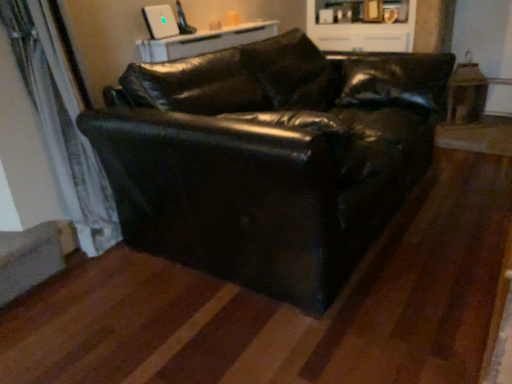
You are a GUI agent. You are given a task and a screenshot of the screen. Output one action in this format:
    pyautogui.click(x=<x>, y=<y>)
    Task: Click on the white glossy cabinet at upper center
    The width and height of the screenshot is (512, 384).
    Given the screenshot: What is the action you would take?
    pyautogui.click(x=362, y=25)

Describe the element at coordinates (62, 127) in the screenshot. The image size is (512, 384). I see `white sheer curtain at left` at that location.

The width and height of the screenshot is (512, 384). I want to click on white glossy table at upper center, so click(205, 41).

Locate an element on the screen. This screenshot has width=512, height=384. black leather couch at center is located at coordinates (269, 159).

Measure the distance between black leather couch at center and camera.

They are 3.93 feet apart.

Locate an element on the screen. white glossy cabinet at upper center is located at coordinates (362, 25).

Is white sheer curtain at left inside the boundaries of black leather couch at center, or outside?

white sheer curtain at left is spatially situated outside black leather couch at center.

Is the surface of white sheer curtain at left in direct contact with black leather couch at center?

white sheer curtain at left is not next to black leather couch at center, and they're not touching.

Where is `studio couch below the white sheer curtain at left (from a real-world perspective)`? The height and width of the screenshot is (384, 512). studio couch below the white sheer curtain at left (from a real-world perspective) is located at coordinates (269, 159).

From a real-world perspective, is white sheer curtain at left beneath white glossy cabinet at upper center?

Correct, in the physical world, white sheer curtain at left is lower than white glossy cabinet at upper center.

Based on the photo, would you say white sheer curtain at left contains white glossy cabinet at upper center?

No, white glossy cabinet at upper center is not a part of white sheer curtain at left.

Is white sheer curtain at left closer to camera compared to white glossy cabinet at upper center?

Yes.

In the scene shown: Based on their sizes in the image, would you say white sheer curtain at left is bigger or smaller than white glossy cabinet at upper center?

Clearly, white sheer curtain at left is smaller in size than white glossy cabinet at upper center.

From the image's perspective, is black leather couch at center positioned above or below white glossy table at upper center?

black leather couch at center is situated lower than white glossy table at upper center in the image.

Can you confirm if black leather couch at center is bigger than white glossy table at upper center?

Yes.

Based on the photo, is black leather couch at center inside or outside of white glossy table at upper center?

black leather couch at center cannot be found inside white glossy table at upper center.

Is black leather couch at center oriented away from white glossy table at upper center?

Correct, black leather couch at center is looking away from white glossy table at upper center.

Does black leather couch at center have a greater height compared to white sheer curtain at left?

In fact, black leather couch at center may be shorter than white sheer curtain at left.

Considering the relative sizes of black leather couch at center and white sheer curtain at left in the image provided, is black leather couch at center thinner than white sheer curtain at left?

No.

What's the angular difference between black leather couch at center and white sheer curtain at left's facing directions?

The facing directions of black leather couch at center and white sheer curtain at left are 0.585 degrees apart.

Does black leather couch at center come behind white sheer curtain at left?

That is False.

Does black leather couch at center touch white glossy cabinet at upper center?

No.

Considering the positions of points (138, 123) and (384, 3), is point (138, 123) closer to camera compared to point (384, 3)?

That is True.

Is black leather couch at center smaller than white glossy cabinet at upper center?

Actually, black leather couch at center might be larger than white glossy cabinet at upper center.

Is white glossy table at upper center taller than white glossy cabinet at upper center?

No, white glossy table at upper center is not taller than white glossy cabinet at upper center.

In the image, is white glossy table at upper center on the left side or the right side of white glossy cabinet at upper center?

Based on their positions, white glossy table at upper center is located to the left of white glossy cabinet at upper center.

Does point (261, 34) come behind point (332, 2)?

No, it is not.

Based on the photo, considering the sizes of white glossy table at upper center and white glossy cabinet at upper center in the image, is white glossy table at upper center bigger or smaller than white glossy cabinet at upper center?

Clearly, white glossy table at upper center is smaller in size than white glossy cabinet at upper center.

Between white glossy cabinet at upper center and black leather couch at center, which one has smaller size?

With smaller size is white glossy cabinet at upper center.

Between point (351, 21) and point (377, 226), which one is positioned behind?

The point (351, 21) is behind.

How many degrees apart are the facing directions of white glossy cabinet at upper center and black leather couch at center?

The angular difference between white glossy cabinet at upper center and black leather couch at center is 88.3 degrees.

Identify the location of curtain located above the black leather couch at center (from a real-world perspective). This screenshot has height=384, width=512. (62, 127).

Locate an element on the screen. curtain in front of the white glossy cabinet at upper center is located at coordinates (62, 127).

From the picture: Looking at the image, which one is located further to white glossy cabinet at upper center, black leather couch at center or white glossy table at upper center?

black leather couch at center is positioned further to the anchor white glossy cabinet at upper center.

Looking at the image, which one is located closer to black leather couch at center, white glossy table at upper center or white glossy cabinet at upper center?

Among the two, white glossy table at upper center is located nearer to black leather couch at center.

From the image, which object appears to be farther from white glossy cabinet at upper center, white sheer curtain at left or black leather couch at center?

white sheer curtain at left.

When comparing their distances from white glossy cabinet at upper center, does white glossy table at upper center or black leather couch at center seem further?

black leather couch at center lies further to white glossy cabinet at upper center than the other object.

When comparing their distances from white glossy table at upper center, does black leather couch at center or white sheer curtain at left seem further?

black leather couch at center.

Looking at the image, which one is located further to white glossy table at upper center, white glossy cabinet at upper center or white sheer curtain at left?

white glossy cabinet at upper center is positioned further to the anchor white glossy table at upper center.

In the scene shown: Looking at the image, which one is located further to black leather couch at center, white glossy cabinet at upper center or white sheer curtain at left?

white glossy cabinet at upper center.

Which object lies nearer to the anchor point black leather couch at center, white sheer curtain at left or white glossy table at upper center?

Among the two, white sheer curtain at left is located nearer to black leather couch at center.

The width and height of the screenshot is (512, 384). What are the coordinates of `curtain located between black leather couch at center and white glossy cabinet at upper center in the depth direction` in the screenshot? It's located at (62, 127).

Where is `table located between black leather couch at center and white glossy cabinet at upper center in the depth direction`? table located between black leather couch at center and white glossy cabinet at upper center in the depth direction is located at coordinates (205, 41).

The image size is (512, 384). I want to click on curtain positioned between black leather couch at center and white glossy table at upper center from near to far, so click(x=62, y=127).

Locate an element on the screen. table between white sheer curtain at left and white glossy cabinet at upper center in the front-back direction is located at coordinates click(x=205, y=41).